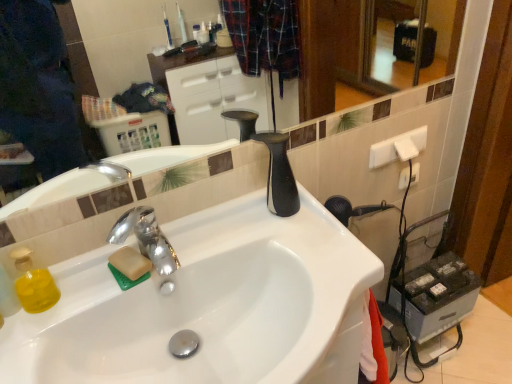
You are a GUI agent. You are given a task and a screenshot of the screen. Output one action in this format:
    pyautogui.click(x=<x>, y=<y>)
    Task: Click on the white glossy sink at center
    
    Given the screenshot: What is the action you would take?
    pyautogui.click(x=209, y=306)

Which object is positioned more to the left, white plastic electric outlet at upper right or white glossy sink at center?

Positioned to the left is white glossy sink at center.

How much distance is there between white plastic electric outlet at upper right and white glossy sink at center?

29.87 inches.

Is white plastic electric outlet at upper right oriented towards white glossy sink at center?

No, white plastic electric outlet at upper right is not aimed at white glossy sink at center.

How many degrees apart are the facing directions of white plastic electric outlet at upper right and white glossy sink at center?

The angle between the facing direction of white plastic electric outlet at upper right and the facing direction of white glossy sink at center is 0.000778 degrees.

Does glossy ceramic mirror at upper center have a greater width compared to chrome metallic faucet at center?

No, glossy ceramic mirror at upper center is not wider than chrome metallic faucet at center.

Is glossy ceramic mirror at upper center spatially inside chrome metallic faucet at center, or outside of it?

glossy ceramic mirror at upper center is spatially situated outside chrome metallic faucet at center.

Does chrome metallic faucet at center touch white plastic electric outlet at upper right?

There is a gap between chrome metallic faucet at center and white plastic electric outlet at upper right.

The width and height of the screenshot is (512, 384). Find the location of `tap lying below the white plastic electric outlet at upper right (from the image's perspective)`. tap lying below the white plastic electric outlet at upper right (from the image's perspective) is located at coordinates (146, 238).

Is chrome metallic faucet at center smaller than white plastic electric outlet at upper right?

No.

Between chrome metallic faucet at center and white plastic electric outlet at upper right, which one appears on the right side from the viewer's perspective?

Positioned to the right is white plastic electric outlet at upper right.

From a real-world perspective, is white glossy sink at center positioned over glossy ceramic mirror at upper center based on gravity?

Incorrect, from a real-world perspective, white glossy sink at center is lower than glossy ceramic mirror at upper center.

Is white glossy sink at center positioned beyond the bounds of glossy ceramic mirror at upper center?

Yes, white glossy sink at center is outside of glossy ceramic mirror at upper center.

Can you see white glossy sink at center touching glossy ceramic mirror at upper center?

white glossy sink at center is not next to glossy ceramic mirror at upper center, and they're not touching.

Is glossy ceramic mirror at upper center facing towards white glossy sink at center?

No, glossy ceramic mirror at upper center does not turn towards white glossy sink at center.

Is white glossy sink at center a part of glossy ceramic mirror at upper center?

No, white glossy sink at center is not a part of glossy ceramic mirror at upper center.

Does glossy ceramic mirror at upper center appear on the left side of white glossy sink at center?

No, glossy ceramic mirror at upper center is not to the left of white glossy sink at center.

Between point (340, 187) and point (55, 372), which one is positioned in front?

The point (55, 372) is more forward.

From the picture: Is white plastic electric outlet at upper right positioned with its back to chrome metallic faucet at center?

No, white plastic electric outlet at upper right is not facing the opposite direction of chrome metallic faucet at center.

Does white plastic electric outlet at upper right have a greater width compared to chrome metallic faucet at center?

In fact, white plastic electric outlet at upper right might be narrower than chrome metallic faucet at center.

In order to click on electric outlet directly beneath the chrome metallic faucet at center (from a real-world perspective) in this screenshot , I will do `click(404, 178)`.

From the image's perspective, which is above, white plastic electric outlet at upper right or chrome metallic faucet at center?

white plastic electric outlet at upper right, from the image's perspective.

Does white glossy sink at center come in front of chrome metallic faucet at center?

Yes, it is.

From a real-world perspective, which is physically below, white glossy sink at center or chrome metallic faucet at center?

white glossy sink at center is physically lower.

From the picture: Is white glossy sink at center not within chrome metallic faucet at center?

That's correct, white glossy sink at center is outside of chrome metallic faucet at center.

Which is closer to the camera, [247,379] or [144,227]?

Point [247,379] is closer to the camera than point [144,227].

In the image, there is a white plastic electric outlet at upper right. Where is `sink below it (from a real-world perspective)`? sink below it (from a real-world perspective) is located at coordinates point(209,306).

At what (x,y) coordinates should I click in order to perform the action: click on mirror above the chrome metallic faucet at center (from a real-world perspective). Please return your answer as a coordinate pair (x, y). Looking at the image, I should click on (213, 100).

Based on their spatial positions, is glossy ceramic mirror at upper center or white glossy sink at center closer to white plastic electric outlet at upper right?

The object closer to white plastic electric outlet at upper right is white glossy sink at center.

Considering their positions, is chrome metallic faucet at center positioned further to white plastic electric outlet at upper right than glossy ceramic mirror at upper center?

glossy ceramic mirror at upper center.

Looking at this image, looking at the image, which one is located closer to white glossy sink at center, glossy ceramic mirror at upper center or chrome metallic faucet at center?

chrome metallic faucet at center is positioned closer to the anchor white glossy sink at center.

Estimate the real-world distances between objects in this image. Which object is closer to white plastic electric outlet at upper right, chrome metallic faucet at center or white glossy sink at center?

Based on the image, white glossy sink at center appears to be nearer to white plastic electric outlet at upper right.

Which object lies nearer to the anchor point chrome metallic faucet at center, white glossy sink at center or glossy ceramic mirror at upper center?

Based on the image, white glossy sink at center appears to be nearer to chrome metallic faucet at center.

Based on their spatial positions, is chrome metallic faucet at center or white glossy sink at center closer to glossy ceramic mirror at upper center?

white glossy sink at center.

Considering their positions, is white plastic electric outlet at upper right positioned further to white glossy sink at center than chrome metallic faucet at center?

Based on the image, white plastic electric outlet at upper right appears to be further to white glossy sink at center.

When comparing their distances from glossy ceramic mirror at upper center, does white plastic electric outlet at upper right or white glossy sink at center seem further?

white glossy sink at center.

Where is `tap between glossy ceramic mirror at upper center and white plastic electric outlet at upper right in the front-back direction`? tap between glossy ceramic mirror at upper center and white plastic electric outlet at upper right in the front-back direction is located at coordinates (146, 238).

I want to click on sink between chrome metallic faucet at center and white plastic electric outlet at upper right in the horizontal direction, so click(x=209, y=306).

At what (x,y) coordinates should I click in order to perform the action: click on electric outlet between glossy ceramic mirror at upper center and white glossy sink at center in the vertical direction. Please return your answer as a coordinate pair (x, y). This screenshot has width=512, height=384. Looking at the image, I should click on (404, 178).

Image resolution: width=512 pixels, height=384 pixels. What are the coordinates of `tap between glossy ceramic mirror at upper center and white glossy sink at center vertically` in the screenshot? It's located at (146, 238).